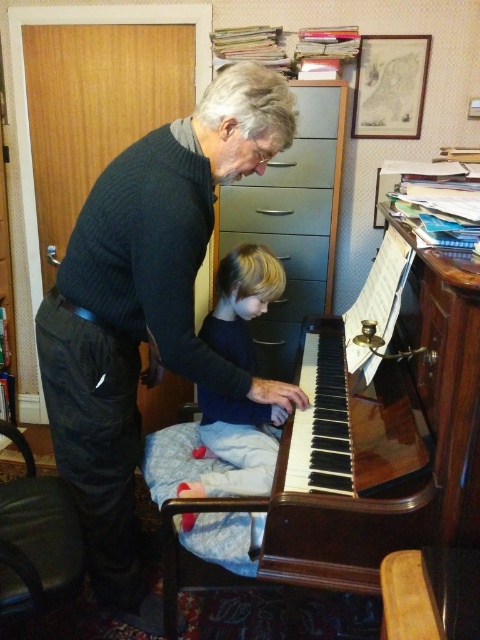
In the scene shown: You are a photographer setting up a shoot in this room. You need to place a 12 inch tall camera tripod between the dark blue sweater at center and the metallic gray drawer at center. Based on their heights, can the tripod be placed so that it doesn

The dark blue sweater at center is taller than the metallic gray drawer at center. Since the tripod is 12 inches tall, it can be placed between them as long as the space between them accommodates its height. However, the exact placement depends on the available space between the two objects.

You are a photographer setting up a shoot in this room. You need to place a small lamp between the dark gray sweater at center and the matte gray drawer at center. Based on their positions, where should the lamp be placed?

The dark gray sweater at center is in front of the matte gray drawer at center, so the lamp should be placed between them along the depth axis, positioning it in front of the drawer but behind the sweater.